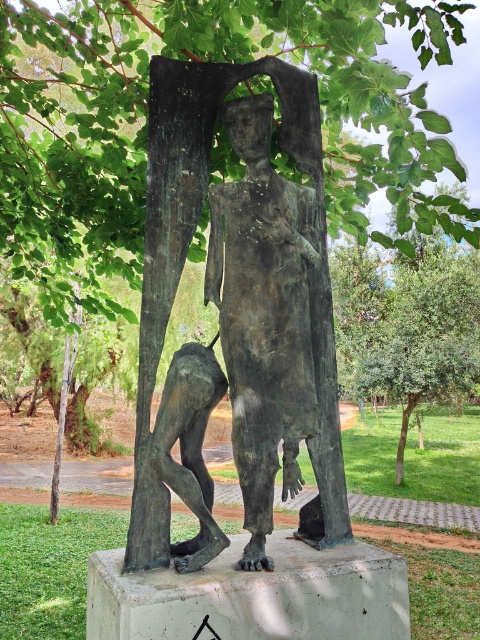
Is bronze statue at center above bronze sculpture at lower left?

Yes.

Who is positioned more to the left, bronze statue at center or bronze sculpture at lower left?

bronze sculpture at lower left

Between point (321, 225) and point (163, 448), which one is positioned in front?

Point (163, 448)

This screenshot has height=640, width=480. I want to click on bronze statue at center, so click(191, 230).